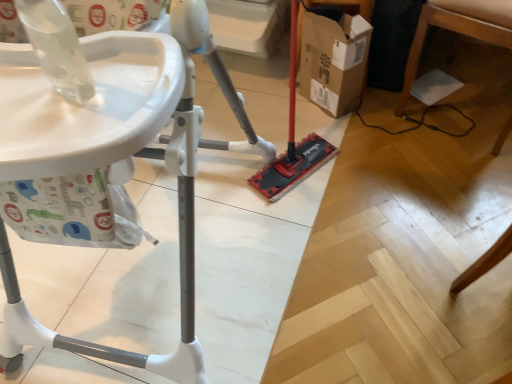
The image size is (512, 384). I want to click on free spot below white plastic high chair at left, which appears as the 1th furniture when viewed from the left (from a real-world perspective), so click(x=149, y=270).